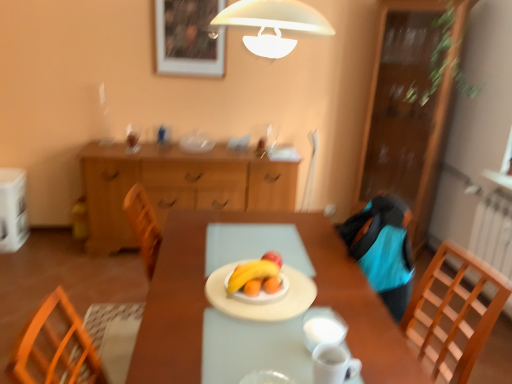
Locate an element on the screen. This screenshot has height=384, width=512. vacant area that lies between white matte plate at center, positioned as the 1th tableware in back-to-front order, and white glossy mug at center, which is counted as the second tableware, starting from the back is located at coordinates (269, 333).